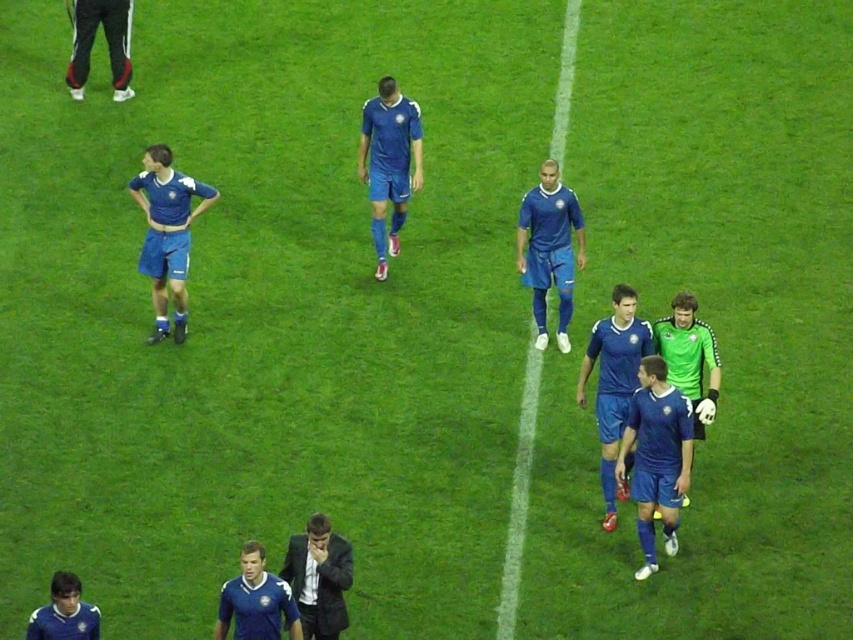
Based on the photo, can you confirm if matte blue uniform at center is positioned to the right of black track pants at upper left?

Yes, matte blue uniform at center is to the right of black track pants at upper left.

Between point (555, 282) and point (128, 45), which one is positioned in front?

Positioned in front is point (555, 282).

Image resolution: width=853 pixels, height=640 pixels. Find the location of `matte blue uniform at center`. matte blue uniform at center is located at coordinates (549, 248).

Does blue fabric soccer uniform at center have a lesser width compared to blue matte soccer player at center?

No, blue fabric soccer uniform at center is not thinner than blue matte soccer player at center.

Between blue fabric soccer uniform at center and blue matte soccer player at center, which one appears on the right side from the viewer's perspective?

From the viewer's perspective, blue matte soccer player at center appears more on the right side.

Who is more forward, (370,224) or (619,294)?

Point (619,294) is in front.

Find the location of a particular element. blue fabric soccer uniform at center is located at coordinates (389, 163).

Consider the image. Which of these two, blue matte soccer jersey at center or blue matte soccer player at center, stands taller?

blue matte soccer player at center is taller.

Can you confirm if blue matte soccer jersey at center is taller than blue matte soccer player at center?

No.

I want to click on blue matte soccer jersey at center, so click(x=656, y=456).